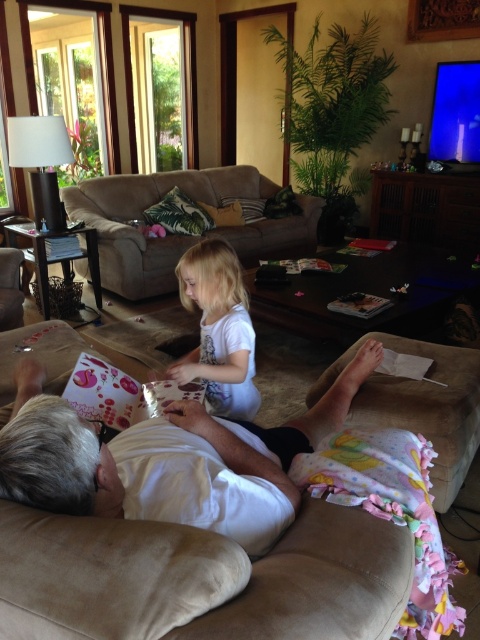
In the living room scene, there is a brown fabric couch at center and a tropical print fabric pillow at center. Which object is positioned to the right of the other?

The brown fabric couch at center is to the right of the tropical print fabric pillow at center.

You are standing in the living room and want to place a small potted plant between the two points marked as point (x=48, y=456) and point (x=226, y=225). Which point should the plant be closer to if you want it to be closer to the sofa?

The plant should be closer to point (x=226, y=225) because point (x=48, y=456) is in front of point (x=226, y=225), meaning point (x=226, y=225) is behind and likely closer to the sofa.

You are trying to decide whether to place a new decorative item on the brown fabric couch at center or the brown fabric pillow at center. Based on their sizes, which one can accommodate a larger object?

The brown fabric couch at center is bigger than the brown fabric pillow at center, so it can accommodate a larger object.